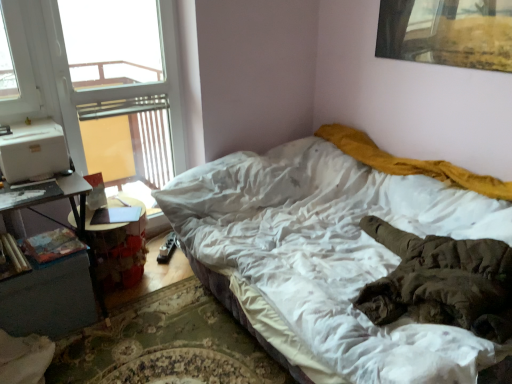
Question: Considering their positions, is white soft bed at center located in front of or behind hardcover book at lower left, marked as the first book in a right-to-left arrangement?

Choices:
 (A) front
 (B) behind

Answer: (A)

Question: Considering the relative positions of white soft bed at center and hardcover book at lower left, acting as the second book starting from the left, in the image provided, is white soft bed at center to the left or to the right of hardcover book at lower left, acting as the second book starting from the left,?

Choices:
 (A) left
 (B) right

Answer: (B)

Question: Estimate the real-world distances between objects in this image. Which object is farther from the dark gray wood nightstand at lower left?

Choices:
 (A) transparent glass window at upper left
 (B) wooden cylindrical at left, the first book from the left
 (C) wooden table at left
 (D) hardcover book at lower left, acting as the second book starting from the left
 (E) white soft bed at center

Answer: (E)

Question: Which of these objects is positioned farthest from the hardcover book at lower left, acting as the second book starting from the left?

Choices:
 (A) white soft bed at center
 (B) wooden table at left
 (C) transparent glass window at upper left
 (D) dark gray wood nightstand at lower left
 (E) wooden cylindrical at left, the first book from the left

Answer: (A)